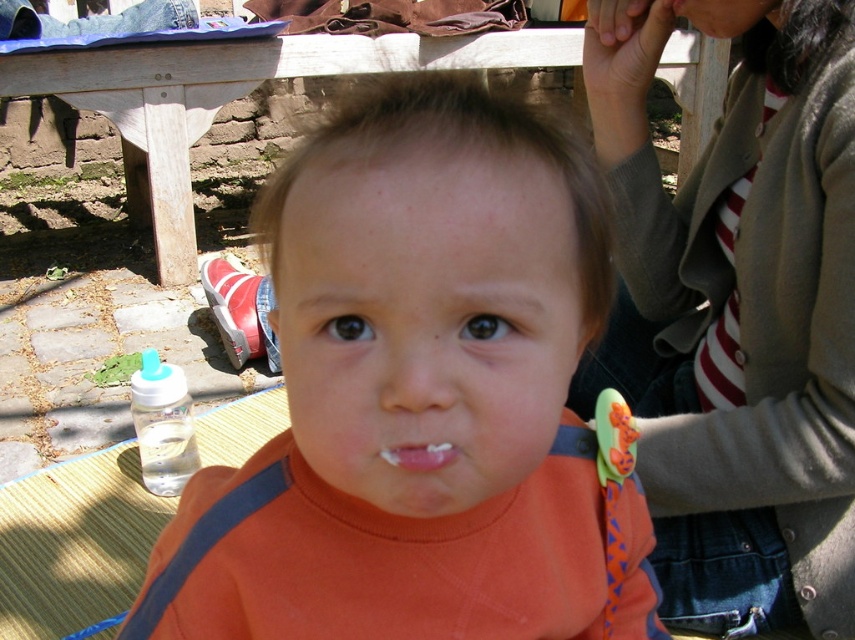
Does point (470, 493) lie in front of point (63, 65)?

Yes.

Is orange fabric bib at center above wooden picnic table at center?

No.

Is point (438, 275) closer to camera compared to point (228, 84)?

Yes, point (438, 275) is in front of point (228, 84).

The image size is (855, 640). In order to click on orange fabric bib at center in this screenshot , I will do `click(420, 397)`.

Between striped fabric tie at upper right and clear plastic bottle at lower left, which one appears on the left side from the viewer's perspective?

clear plastic bottle at lower left is more to the left.

Measure the distance from striped fabric tie at upper right to clear plastic bottle at lower left.

striped fabric tie at upper right and clear plastic bottle at lower left are 28.63 inches apart from each other.

Is point (700, 573) positioned after point (192, 436)?

No, it is not.

The image size is (855, 640). What are the coordinates of `striped fabric tie at upper right` in the screenshot? It's located at (736, 312).

Does clear plastic bottle at lower left appear under pink glossy lips at center?

Correct, clear plastic bottle at lower left is located below pink glossy lips at center.

This screenshot has width=855, height=640. What are the coordinates of `clear plastic bottle at lower left` in the screenshot? It's located at (162, 426).

Is point (171, 369) farther from viewer compared to point (426, 465)?

Yes, it is.

Where is `clear plastic bottle at lower left`? clear plastic bottle at lower left is located at coordinates (162, 426).